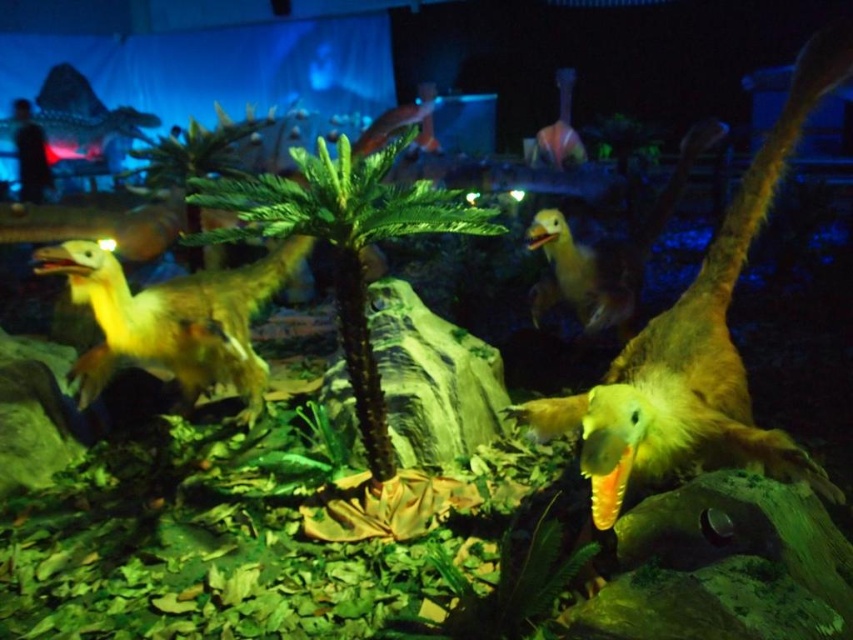
You are a visitor in the museum and want to take a photo of the yellow matte dinosaur at center without the yellow matte dinosaur at left appearing in the background. Is this possible based on their positions?

The yellow matte dinosaur at center is positioned over the yellow matte dinosaur at left, so if you position yourself to focus on the yellow matte dinosaur at center from an angle where the one below is out of frame, it should be possible to capture the desired shot without the other appearing in the background.

You are a visitor in the museum and want to take a photo of the yellow matte duck at center without the yellow matte dinosaur at center blocking it. Is the duck visible behind the dinosaur?

The yellow matte dinosaur at center is in front of the yellow matte duck at center, so the duck is partially or fully hidden behind the dinosaur. You might need to adjust your position to capture the duck without the dinosaur blocking it.